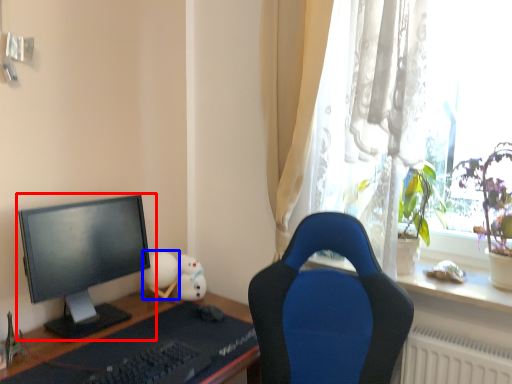
Question: Which object appears farthest to the camera in this image, computer monitor (highlighted by a red box) or toy (highlighted by a blue box)?

Choices:
 (A) computer monitor
 (B) toy

Answer: (B)